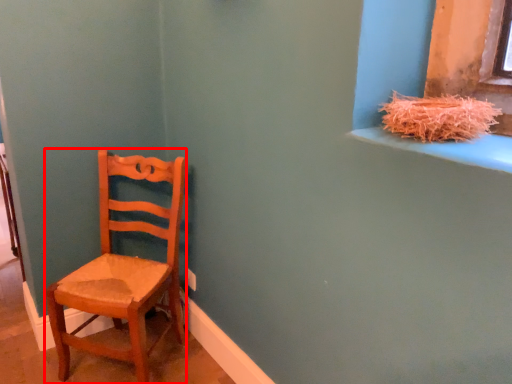
Question: From the image, what is the correct spatial relationship of chair (annotated by the red box) in relation to straw?

Choices:
 (A) right
 (B) left

Answer: (B)